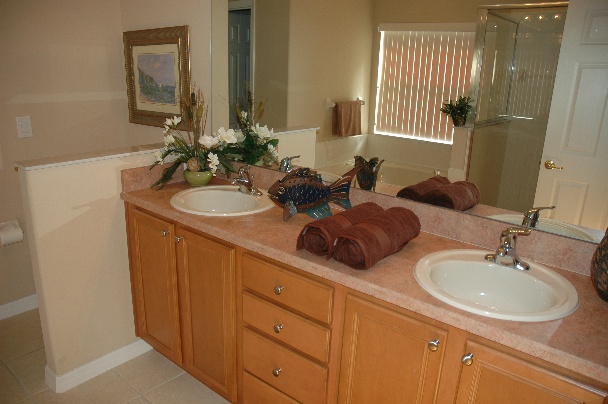
Locate an element on the screen. picture is located at coordinates (159, 61).